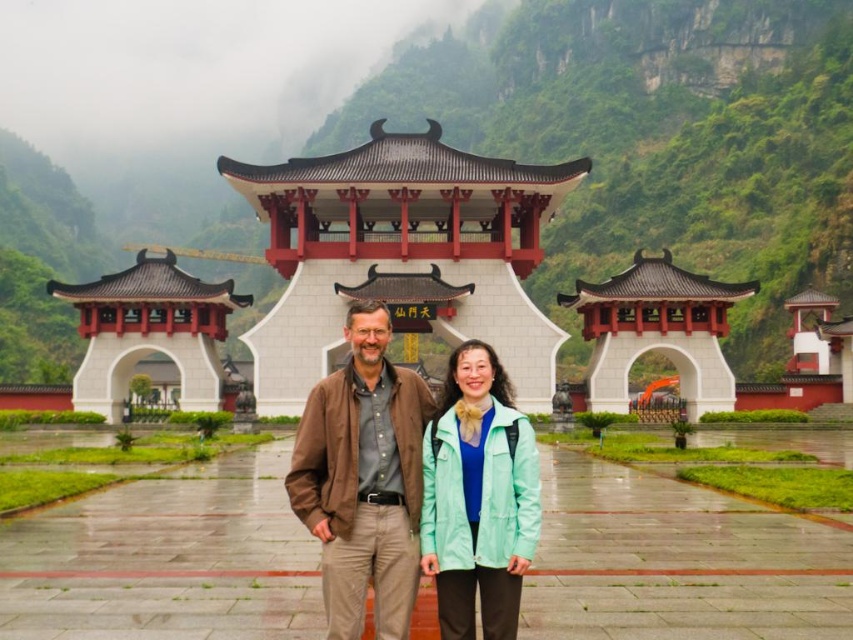
Who is positioned more to the right, brown leather jacket at center or mint green fabric jacket at center?

mint green fabric jacket at center is more to the right.

Is brown leather jacket at center below mint green fabric jacket at center?

No.

Is point (387, 442) closer to viewer compared to point (485, 394)?

Yes, it is in front of point (485, 394).

The height and width of the screenshot is (640, 853). Identify the location of brown leather jacket at center. (363, 480).